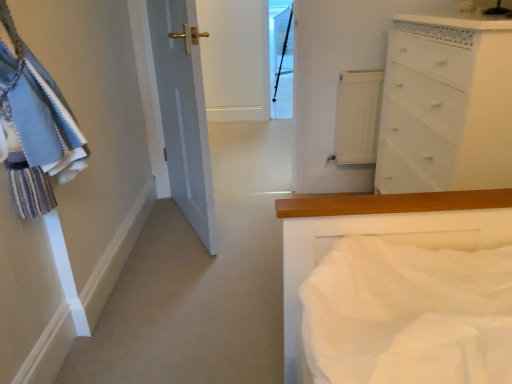
Question: Can you confirm if transparent glass door at upper center is taller than white painted wood chest of drawers at upper right?

Choices:
 (A) yes
 (B) no

Answer: (A)

Question: From a real-world perspective, is transparent glass door at upper center beneath white painted wood chest of drawers at upper right?

Choices:
 (A) yes
 (B) no

Answer: (B)

Question: Can you confirm if transparent glass door at upper center is wider than white painted wood chest of drawers at upper right?

Choices:
 (A) yes
 (B) no

Answer: (A)

Question: Is transparent glass door at upper center smaller than white painted wood chest of drawers at upper right?

Choices:
 (A) no
 (B) yes

Answer: (B)

Question: Does transparent glass door at upper center turn towards white painted wood chest of drawers at upper right?

Choices:
 (A) yes
 (B) no

Answer: (B)

Question: Is transparent glass door at upper center wider or thinner than white wood radiator at upper center?

Choices:
 (A) thin
 (B) wide

Answer: (B)

Question: Considering the positions of point (288, 115) and point (355, 81), is point (288, 115) closer or farther from the camera than point (355, 81)?

Choices:
 (A) closer
 (B) farther

Answer: (B)

Question: Relative to white wood radiator at upper center, is transparent glass door at upper center in front or behind?

Choices:
 (A) behind
 (B) front

Answer: (A)

Question: From a real-world perspective, is transparent glass door at upper center physically located above or below white wood radiator at upper center?

Choices:
 (A) above
 (B) below

Answer: (A)

Question: Based on their sizes in the image, would you say transparent glass door at upper center is bigger or smaller than white painted wood chest of drawers at upper right?

Choices:
 (A) small
 (B) big

Answer: (A)

Question: Based on their positions, is transparent glass door at upper center located to the left or right of white painted wood chest of drawers at upper right?

Choices:
 (A) right
 (B) left

Answer: (B)

Question: Is transparent glass door at upper center inside or outside of white painted wood chest of drawers at upper right?

Choices:
 (A) inside
 (B) outside

Answer: (B)

Question: Considering the positions of point (284, 8) and point (422, 160), is point (284, 8) closer or farther from the camera than point (422, 160)?

Choices:
 (A) closer
 (B) farther

Answer: (B)

Question: Does point (423, 132) appear closer or farther from the camera than point (278, 44)?

Choices:
 (A) farther
 (B) closer

Answer: (B)

Question: From a real-world perspective, relative to transparent glass door at upper center, is white painted wood chest of drawers at upper right vertically above or below?

Choices:
 (A) below
 (B) above

Answer: (A)